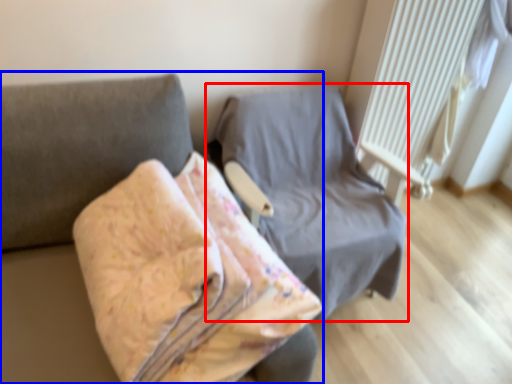
Question: Which object is closer to the camera taking this photo, furniture (highlighted by a red box) or furniture (highlighted by a blue box)?

Choices:
 (A) furniture
 (B) furniture

Answer: (B)